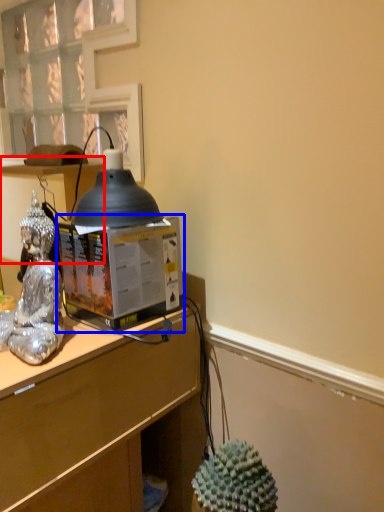
Question: Which object appears farthest to the camera in this image, vanity (highlighted by a red box) or desktop computer (highlighted by a blue box)?

Choices:
 (A) vanity
 (B) desktop computer

Answer: (A)